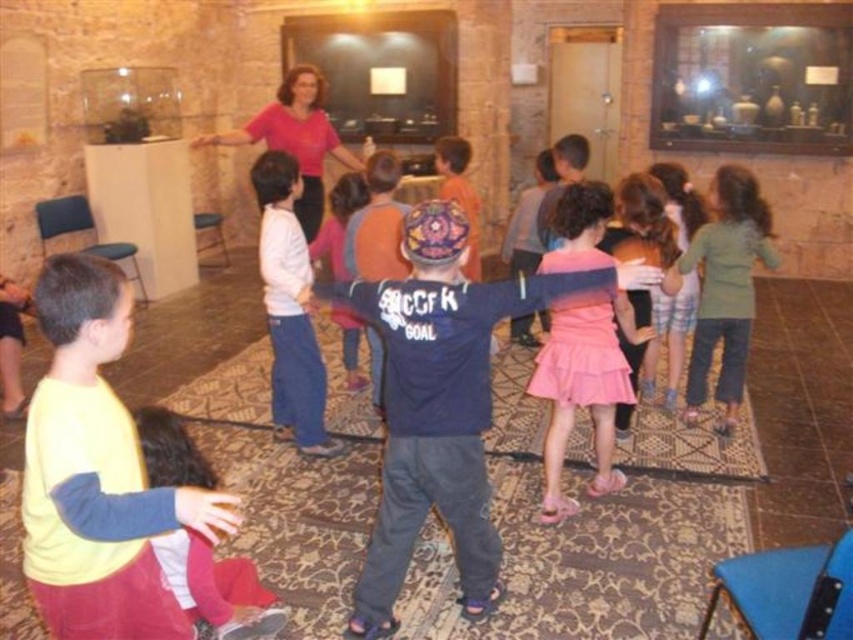
In the scene shown: You are a photographer trying to capture a group photo of the children in the scene. You notice two children wearing a pink satin dress at center and a green cotton shirt at center. Which child should you focus on to ensure both are visible in the photo?

The pink satin dress at center is in front of the green cotton shirt at center, so focusing on the pink satin dress at center will ensure both are visible as it is closer to the camera.